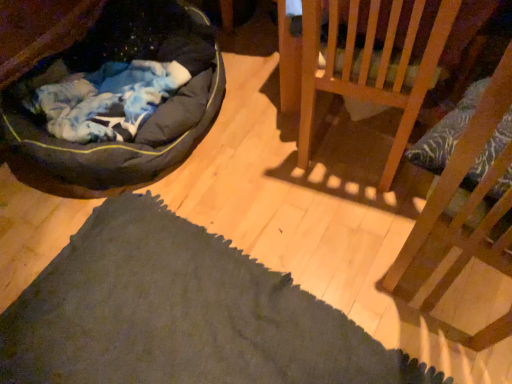
Question: Can you confirm if wooden chair at upper right, which is the 2th furniture in front-to-back order, is smaller than dark gray fabric dog bed at left?

Choices:
 (A) yes
 (B) no

Answer: (A)

Question: Is the surface of wooden chair at upper right, which is the 2th furniture in front-to-back order, in direct contact with dark gray fabric dog bed at left?

Choices:
 (A) yes
 (B) no

Answer: (B)

Question: From the image's perspective, is wooden chair at upper right, arranged as the first furniture when viewed from the back, located above dark gray fabric dog bed at left?

Choices:
 (A) yes
 (B) no

Answer: (B)

Question: Is wooden chair at upper right, which is the 2th furniture in front-to-back order, positioned behind dark gray fabric dog bed at left?

Choices:
 (A) no
 (B) yes

Answer: (B)

Question: Based on their sizes in the image, would you say wooden chair at upper right, arranged as the first furniture when viewed from the back, is bigger or smaller than dark gray fabric dog bed at left?

Choices:
 (A) big
 (B) small

Answer: (B)

Question: Relative to dark gray fabric dog bed at left, is wooden chair at upper right, arranged as the first furniture when viewed from the back, in front or behind?

Choices:
 (A) front
 (B) behind

Answer: (B)

Question: From a real-world perspective, is wooden chair at upper right, arranged as the first furniture when viewed from the back, positioned above or below dark gray fabric dog bed at left?

Choices:
 (A) above
 (B) below

Answer: (B)

Question: From the image's perspective, relative to dark gray fabric dog bed at left, is wooden chair at upper right, which is the 2th furniture in front-to-back order, above or below?

Choices:
 (A) below
 (B) above

Answer: (A)

Question: Is point (174, 57) positioned closer to the camera than point (474, 129)?

Choices:
 (A) farther
 (B) closer

Answer: (A)

Question: Which is correct: dark gray fabric dog bed at left is inside wooden chair at right, acting as the 1th furniture starting from the front, or outside of it?

Choices:
 (A) inside
 (B) outside

Answer: (B)

Question: From the image's perspective, is dark gray fabric dog bed at left located above or below wooden chair at right, acting as the 1th furniture starting from the front?

Choices:
 (A) below
 (B) above

Answer: (B)

Question: Considering the positions of dark gray fabric dog bed at left and wooden chair at right, acting as the 1th furniture starting from the front, in the image, is dark gray fabric dog bed at left wider or thinner than wooden chair at right, acting as the 1th furniture starting from the front,?

Choices:
 (A) thin
 (B) wide

Answer: (B)

Question: Based on their sizes in the image, would you say wooden chair at upper right, arranged as the first furniture when viewed from the back, is bigger or smaller than wooden chair at right, acting as the 1th furniture starting from the front?

Choices:
 (A) small
 (B) big

Answer: (A)

Question: Visually, is wooden chair at upper right, arranged as the first furniture when viewed from the back, positioned to the left or to the right of wooden chair at right, acting as the 1th furniture starting from the front?

Choices:
 (A) left
 (B) right

Answer: (A)